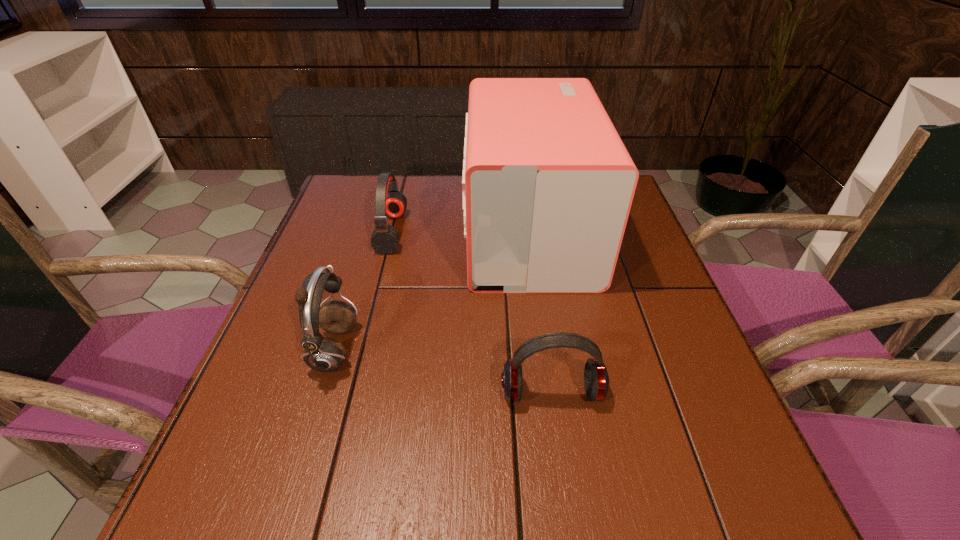
Image resolution: width=960 pixels, height=540 pixels. I want to click on box, so click(548, 184).

I want to click on the second tallest object, so click(324, 354).

Image resolution: width=960 pixels, height=540 pixels. Identify the location of the farthest earphone. (390, 202).

I want to click on the rightmost earphone, so coord(596,380).

You are a GUI agent. You are given a task and a screenshot of the screen. Output one action in this format:
    pyautogui.click(x=<x>, y=<y>)
    Task: Click on the vacant point located 0.320m on the surface of the box where the text is embossed
    
    Given the screenshot: What is the action you would take?
    pyautogui.click(x=343, y=232)

Image resolution: width=960 pixels, height=540 pixels. I want to click on free point located on the surface of the box where the text is embossed, so click(x=316, y=232).

Find the location of a particular element. This screenshot has width=960, height=540. free space located on the surface of the box where the text is embossed is located at coordinates (350, 232).

Where is `free space located on the ear pads of the tallest earphone`? free space located on the ear pads of the tallest earphone is located at coordinates (551, 350).

The height and width of the screenshot is (540, 960). In order to click on vacant area situated on the ear cups of the farthest earphone in this screenshot , I will do `click(482, 232)`.

The width and height of the screenshot is (960, 540). Identify the location of vacant space situated on the ear cups of the rightmost earphone. (565, 488).